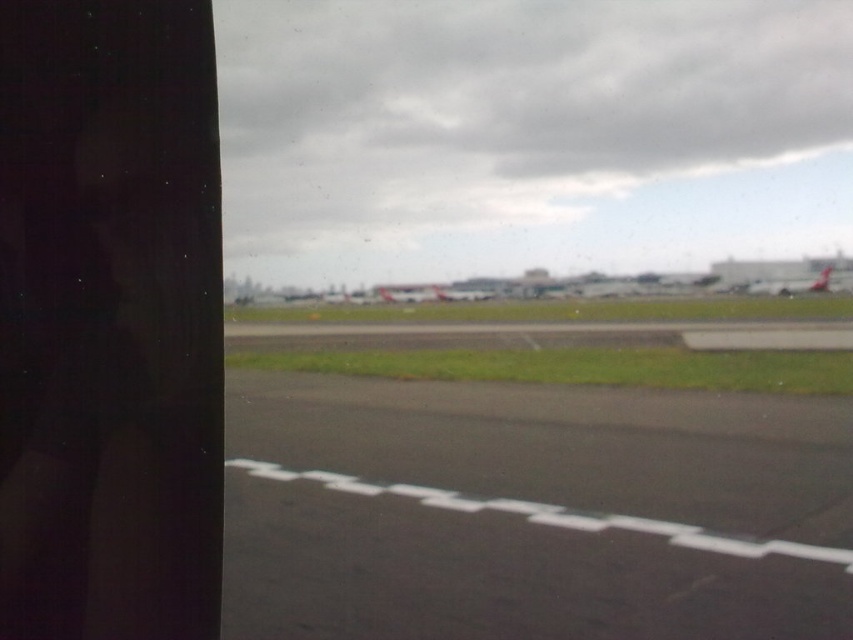
Describe the element at coordinates (532, 512) in the screenshot. I see `black asphalt tarmac at center` at that location.

Does black asphalt tarmac at center have a greater width compared to metallic silver airplane at right?

No.

Does point (403, 433) come closer to viewer compared to point (780, 291)?

Yes.

Locate an element on the screen. black asphalt tarmac at center is located at coordinates (532, 512).